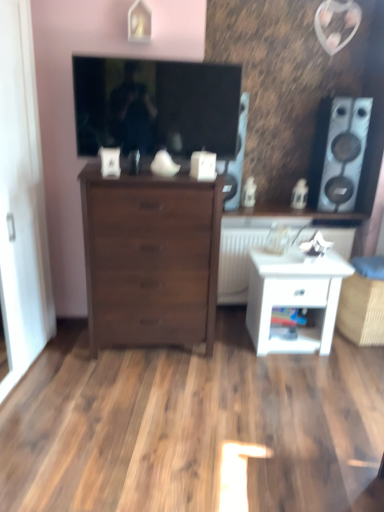
Question: Considering the relative sizes of matte black speaker at upper center, which is the second speaker in right-to-left order, and white matte radiator at center in the image provided, is matte black speaker at upper center, which is the second speaker in right-to-left order, shorter than white matte radiator at center?

Choices:
 (A) yes
 (B) no

Answer: (B)

Question: Is matte black speaker at upper center, which is the second speaker in right-to-left order, completely or partially outside of white matte radiator at center?

Choices:
 (A) yes
 (B) no

Answer: (A)

Question: Considering the relative sizes of matte black speaker at upper center, the 1th speaker when ordered from left to right, and white matte radiator at center in the image provided, is matte black speaker at upper center, the 1th speaker when ordered from left to right, taller than white matte radiator at center?

Choices:
 (A) yes
 (B) no

Answer: (A)

Question: Could white matte radiator at center be considered to be inside matte black speaker at upper center, which is the second speaker in right-to-left order?

Choices:
 (A) no
 (B) yes

Answer: (A)

Question: Is matte black speaker at upper center, which is the second speaker in right-to-left order, smaller than white matte radiator at center?

Choices:
 (A) no
 (B) yes

Answer: (B)

Question: Considering the positions of point (251, 232) and point (339, 164), is point (251, 232) closer or farther from the camera than point (339, 164)?

Choices:
 (A) closer
 (B) farther

Answer: (A)

Question: In terms of size, does white matte radiator at center appear bigger or smaller than white glossy speaker at right, acting as the second speaker starting from the left?

Choices:
 (A) big
 (B) small

Answer: (A)

Question: From their relative heights in the image, would you say white matte radiator at center is taller or shorter than white glossy speaker at right, marked as the first speaker in a right-to-left arrangement?

Choices:
 (A) short
 (B) tall

Answer: (A)

Question: Is white matte radiator at center wider or thinner than white glossy speaker at right, marked as the first speaker in a right-to-left arrangement?

Choices:
 (A) thin
 (B) wide

Answer: (B)

Question: Choose the correct answer: Is white glossy speaker at right, acting as the second speaker starting from the left, inside matte black tv at upper center or outside it?

Choices:
 (A) inside
 (B) outside

Answer: (B)

Question: Considering their positions, is white glossy speaker at right, marked as the first speaker in a right-to-left arrangement, located in front of or behind matte black tv at upper center?

Choices:
 (A) behind
 (B) front

Answer: (A)

Question: In terms of height, does white glossy speaker at right, marked as the first speaker in a right-to-left arrangement, look taller or shorter compared to matte black tv at upper center?

Choices:
 (A) short
 (B) tall

Answer: (B)

Question: From the image's perspective, is white glossy speaker at right, acting as the second speaker starting from the left, above or below matte black tv at upper center?

Choices:
 (A) below
 (B) above

Answer: (A)

Question: Considering the positions of point (316, 288) and point (218, 292), is point (316, 288) closer or farther from the camera than point (218, 292)?

Choices:
 (A) closer
 (B) farther

Answer: (A)

Question: In terms of height, does white glossy nightstand at lower right look taller or shorter compared to white matte radiator at center?

Choices:
 (A) short
 (B) tall

Answer: (A)